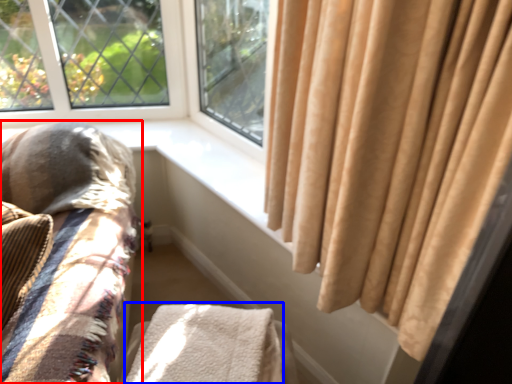
Question: Which object appears closest to the camera in this image, furniture (highlighted by a red box) or blanket (highlighted by a blue box)?

Choices:
 (A) furniture
 (B) blanket

Answer: (A)